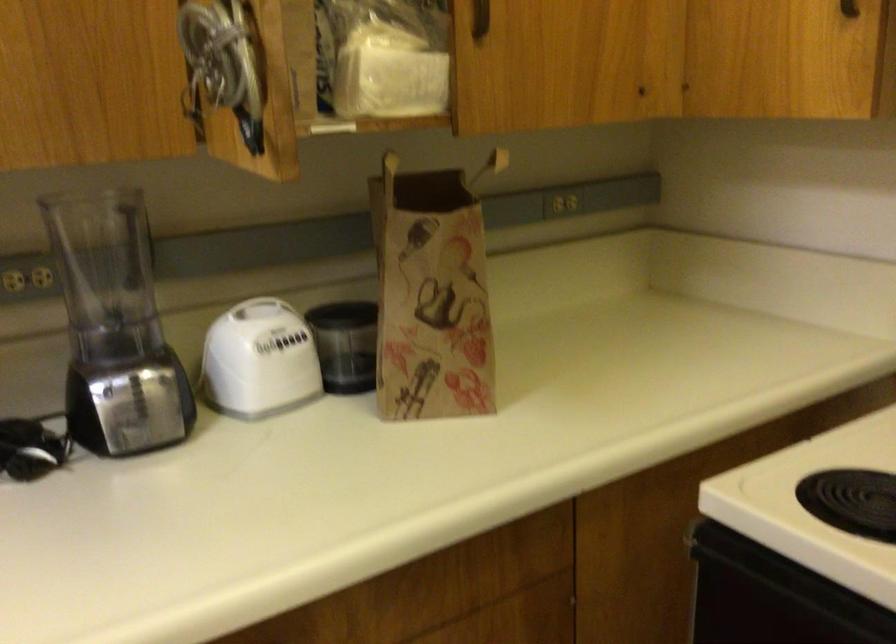
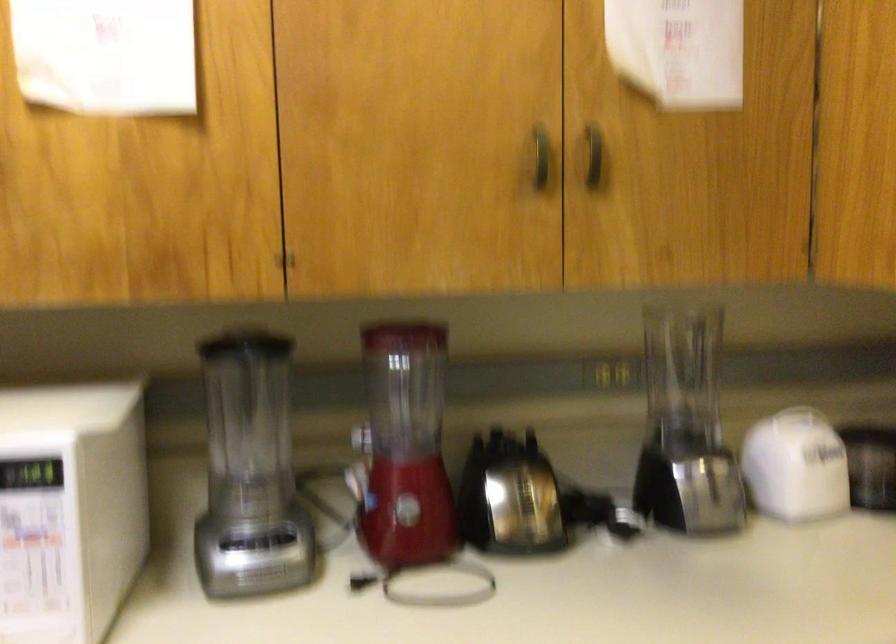
Question: The camera is either moving clockwise (left) or counter-clockwise (right) around the object. The first image is from the beginning of the video and the second image is from the end. Is the camera moving left or right when shooting the video?

Choices:
 (A) Left
 (B) Right

Answer: (B)